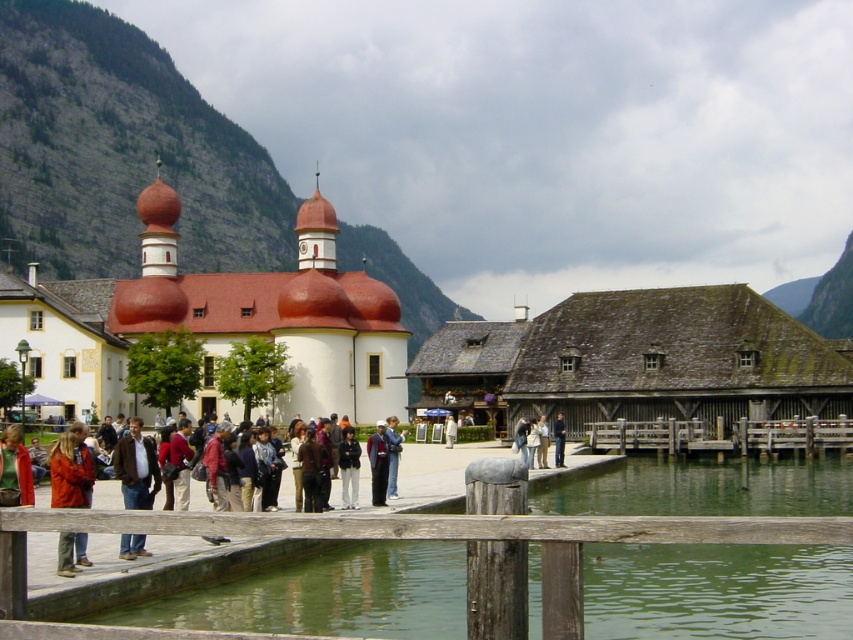
In the scene shown: You are a photographer planning to capture a wide shot of the white matte church at center and the wooden dock at lower center. Which object should you position closer to the edge of your camera frame to ensure both are fully visible in the shot?

Since the white matte church at center is wider than the wooden dock at lower center, you should position the white matte church at center closer to the edge of your camera frame to ensure both objects fit within the shot.